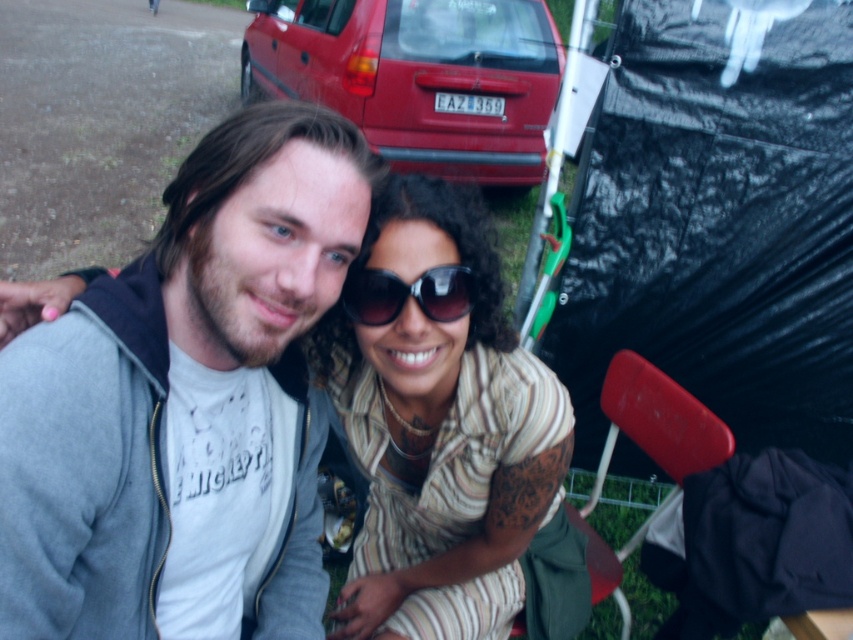
How much distance is there between gray fleece jacket at center and black plastic tent at right?

1.48 meters

Between gray fleece jacket at center and black plastic tent at right, which one is positioned higher?

black plastic tent at right

Which is in front, point (109, 522) or point (730, 132)?

Point (109, 522)

Locate an element on the screen. This screenshot has width=853, height=640. gray fleece jacket at center is located at coordinates (187, 403).

Can you confirm if gray fleece jacket at center is taller than red plastic chair at lower right?

Incorrect, gray fleece jacket at center's height is not larger of red plastic chair at lower right's.

The image size is (853, 640). Describe the element at coordinates (187, 403) in the screenshot. I see `gray fleece jacket at center` at that location.

Identify the location of gray fleece jacket at center. (187, 403).

Is matte red car at upper center wider than red plastic chair at lower right?

Yes.

Between point (508, 35) and point (608, 570), which one is positioned in front?

Point (608, 570) is in front.

Locate an element on the screen. The width and height of the screenshot is (853, 640). matte red car at upper center is located at coordinates (418, 76).